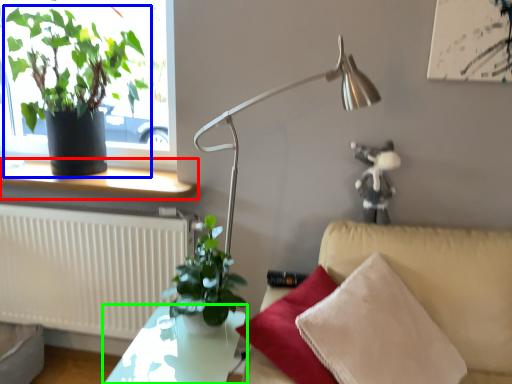
Question: Based on their relative distances, which object is nearer to window sill (highlighted by a red box)? Choose from houseplant (highlighted by a blue box) and table (highlighted by a green box).

Choices:
 (A) houseplant
 (B) table

Answer: (A)